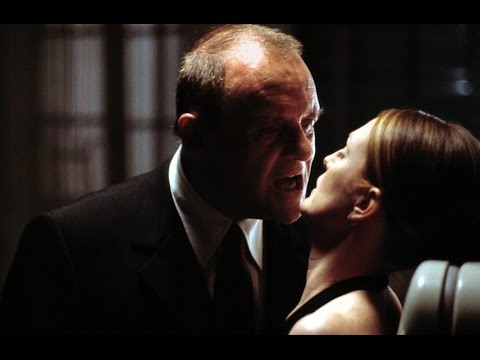
Where is `curtain`? Image resolution: width=480 pixels, height=360 pixels. curtain is located at coordinates (60, 158).